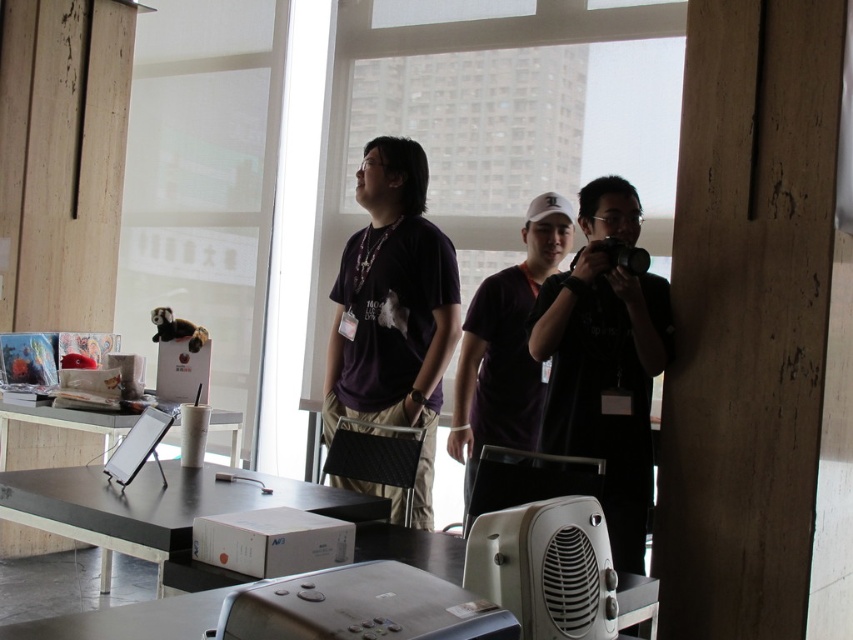
Can you confirm if slate gray plastic projector at lower center is wider than purple matte shirt at center?

No, slate gray plastic projector at lower center is not wider than purple matte shirt at center.

Is point (306, 609) farther from viewer compared to point (469, 385)?

No, it is not.

Image resolution: width=853 pixels, height=640 pixels. What do you see at coordinates (361, 608) in the screenshot? I see `slate gray plastic projector at lower center` at bounding box center [361, 608].

At what (x,y) coordinates should I click in order to perform the action: click on slate gray plastic projector at lower center. Please return your answer as a coordinate pair (x, y). Looking at the image, I should click on (361, 608).

From the picture: Between matte black shirt at center and slate gray plastic projector at lower center, which one is positioned lower?

Positioned lower is slate gray plastic projector at lower center.

I want to click on matte black shirt at center, so click(x=393, y=308).

Where is `matte black shirt at center`? This screenshot has width=853, height=640. matte black shirt at center is located at coordinates 393,308.

Locate an element on the screen. matte black shirt at center is located at coordinates (393, 308).

Does matte black shirt at center have a smaller size compared to purple matte shirt at center?

No.

Between point (341, 300) and point (477, 353), which one is positioned behind?

The point (477, 353) is behind.

Find the location of a particular element. Image resolution: width=853 pixels, height=640 pixels. matte black shirt at center is located at coordinates (393, 308).